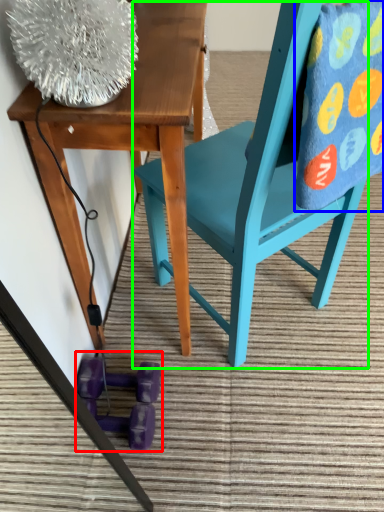
Question: Which is nearer to the toy (highlighted by a red box)? blanket (highlighted by a blue box) or chair (highlighted by a green box).

Choices:
 (A) blanket
 (B) chair

Answer: (B)